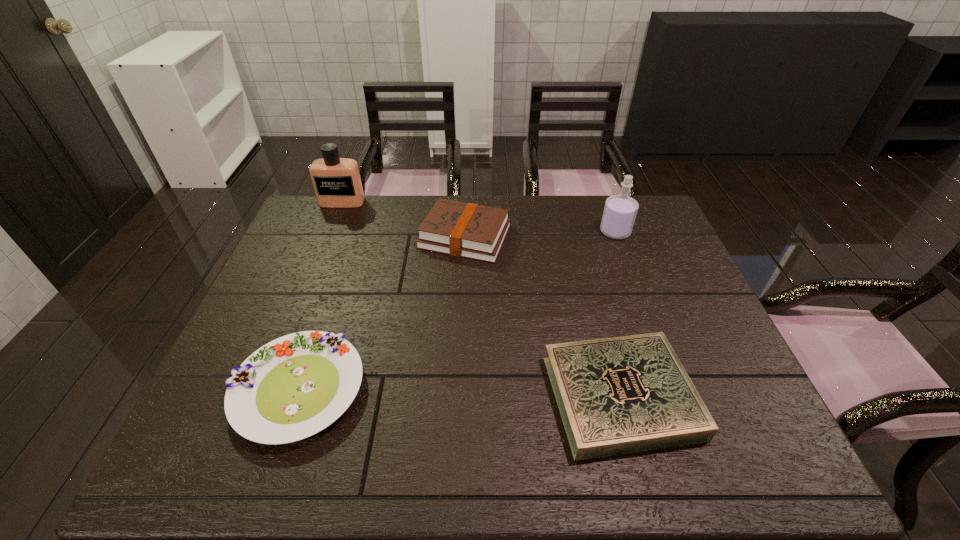
Locate an element on the screen. This screenshot has height=540, width=960. vacant point located between the salad plate and the shorter hardback book is located at coordinates (460, 393).

Where is `empty location between the nearer perfume and the nearer hardback book`? empty location between the nearer perfume and the nearer hardback book is located at coordinates (618, 314).

This screenshot has width=960, height=540. Find the location of `free space between the salad plate and the right perfume`. free space between the salad plate and the right perfume is located at coordinates (457, 310).

At what (x,y) coordinates should I click in order to perform the action: click on free space that is in between the third tallest object and the nearer perfume. Please return your answer as a coordinate pair (x, y). The width and height of the screenshot is (960, 540). Looking at the image, I should click on (540, 234).

You are a GUI agent. You are given a task and a screenshot of the screen. Output one action in this format:
    pyautogui.click(x=<x>, y=<y>)
    Task: Click on the vacant area that lies between the taller hardback book and the nearer perfume
    
    Given the screenshot: What is the action you would take?
    pyautogui.click(x=540, y=234)

You are a GUI agent. You are given a task and a screenshot of the screen. Output one action in this format:
    pyautogui.click(x=<x>, y=<y>)
    Task: Click on the free space between the salad plate and the nearer perfume
    This screenshot has height=540, width=960.
    Given the screenshot: What is the action you would take?
    pyautogui.click(x=457, y=310)

The height and width of the screenshot is (540, 960). Find the location of `unoccupied area between the salad plate and the left perfume`. unoccupied area between the salad plate and the left perfume is located at coordinates (321, 295).

Find the location of a particular element. vacant area that lies between the taller hardback book and the right perfume is located at coordinates (540, 234).

Identify which object is the nearest to the farthest object. Please provide its 2D coordinates. Your answer should be formatted as a tuple, i.e. [(x, y)], where the tuple contains the x and y coordinates of a point satisfying the conditions above.

[(468, 230)]

Where is `object that is the closest to the right perfume`? object that is the closest to the right perfume is located at coordinates (468, 230).